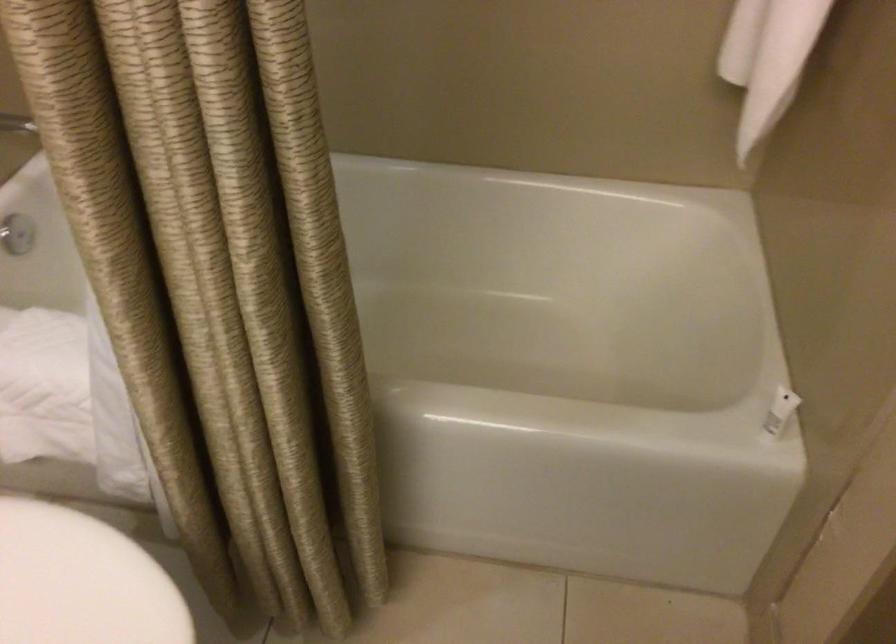
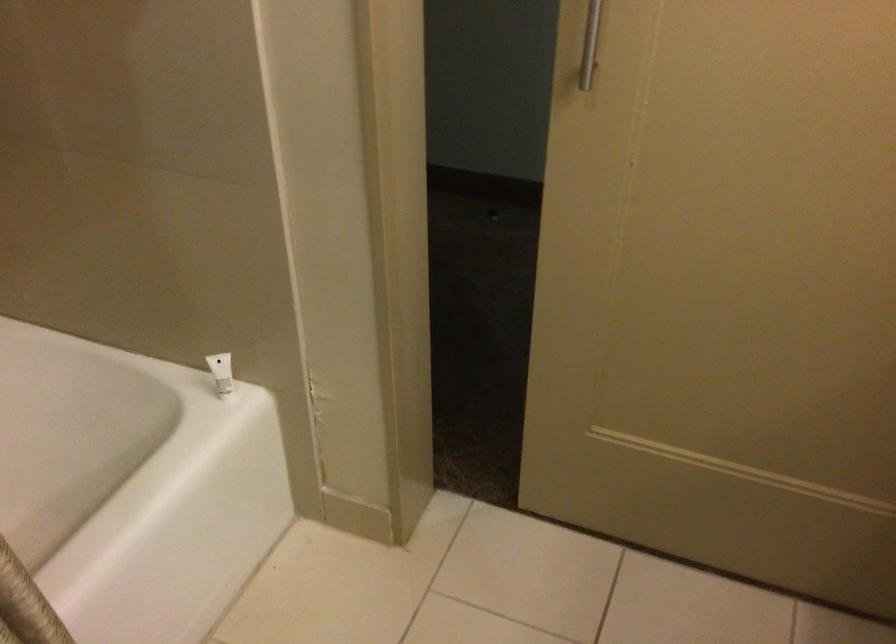
How did the camera likely rotate?

The rotation direction of the camera is right-down.